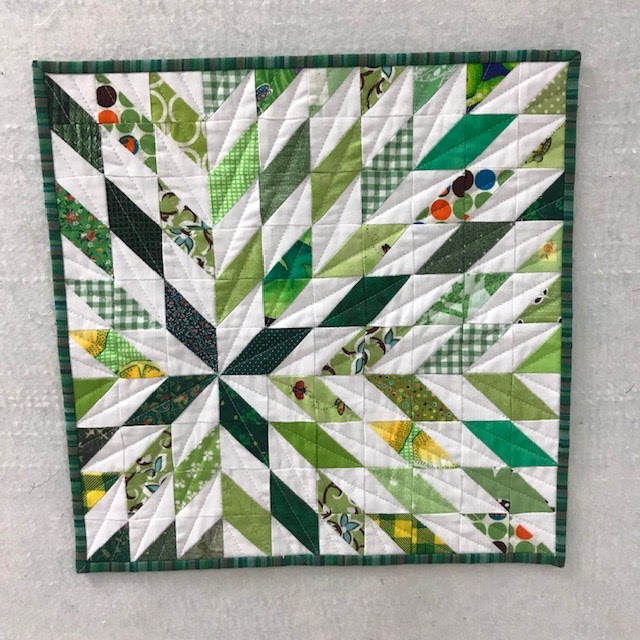
Identify the location of space to left of quilt. The width and height of the screenshot is (640, 640). (x=32, y=348).